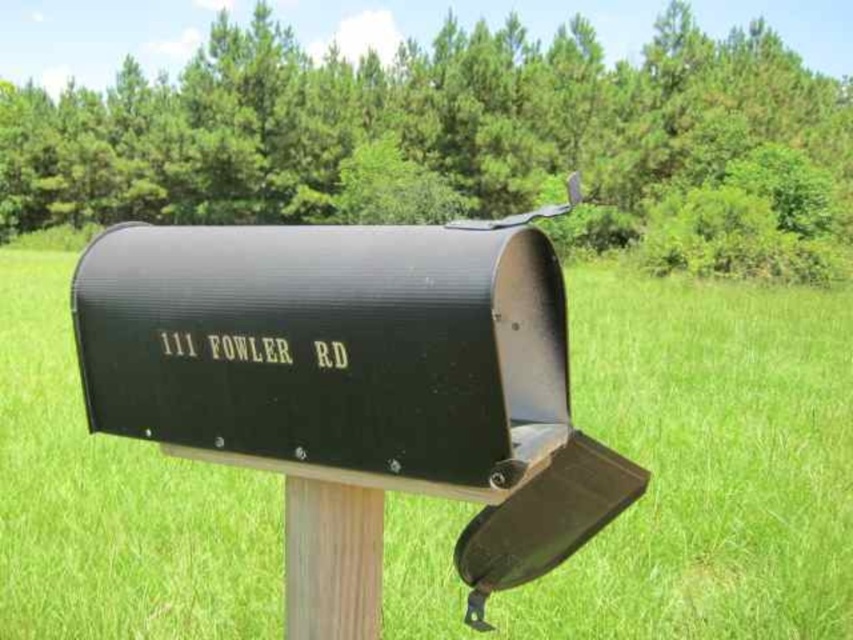
Which of these two, black matte mailbox at center or wooden post at center, stands taller?

black matte mailbox at center

Between point (763, 296) and point (347, 604), which one is positioned in front?

Positioned in front is point (347, 604).

You are a GUI agent. You are given a task and a screenshot of the screen. Output one action in this format:
    pyautogui.click(x=<x>, y=<y>)
    Task: Click on the black matte mailbox at center
    The width and height of the screenshot is (853, 640).
    Given the screenshot: What is the action you would take?
    pyautogui.click(x=679, y=474)